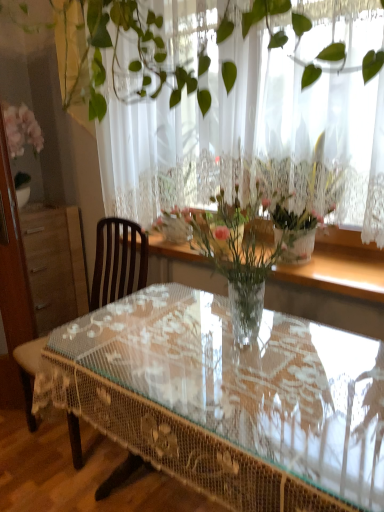
What are the coordinates of `brown wooden chair at left` in the screenshot? It's located at (118, 260).

What do you see at coordinates (239, 243) in the screenshot? I see `clear glass vase at center` at bounding box center [239, 243].

Measure the distance between clear wood window sill at upper center and camera.

clear wood window sill at upper center and camera are 1.62 meters apart.

Locate an element on the screen. This screenshot has width=384, height=512. brown wooden chair at left is located at coordinates (118, 260).

Is clear glass vase at center not near clear glass table at center?

No.

From the picture: Is clear glass vase at center oriented away from clear glass table at center?

No, clear glass vase at center is not facing away from clear glass table at center.

How different are the orientations of clear glass vase at center and clear glass table at center in degrees?

The angle between the facing direction of clear glass vase at center and the facing direction of clear glass table at center is 0.839 degrees.

Considering the sizes of objects clear glass vase at center and clear glass table at center in the image provided, who is shorter, clear glass vase at center or clear glass table at center?

clear glass vase at center.

From the image's perspective, relative to clear wood window sill at upper center, is white lace curtain at upper center above or below?

white lace curtain at upper center is situated higher than clear wood window sill at upper center in the image.

Is white lace curtain at upper center positioned with its back to clear wood window sill at upper center?

Absolutely, white lace curtain at upper center is directed away from clear wood window sill at upper center.

Is the depth of white lace curtain at upper center less than that of clear wood window sill at upper center?

Yes, it is in front of clear wood window sill at upper center.

Between clear glass table at center and clear glass vase at center, which one has smaller size?

Smaller between the two is clear glass vase at center.

From the image's perspective, is clear glass table at center located beneath clear glass vase at center?

Indeed, from the image's perspective, clear glass table at center is shown beneath clear glass vase at center.

Where is `coffee table on the left of clear glass vase at center`? The height and width of the screenshot is (512, 384). coffee table on the left of clear glass vase at center is located at coordinates (228, 399).

How distant is clear glass table at center from clear glass vase at center?

clear glass table at center and clear glass vase at center are 14.09 inches apart from each other.

Considering the sizes of white lace curtain at upper center and clear glass table at center in the image, is white lace curtain at upper center taller or shorter than clear glass table at center?

Considering their sizes, white lace curtain at upper center has more height than clear glass table at center.

Is white lace curtain at upper center oriented towards clear glass table at center?

No, white lace curtain at upper center is not oriented towards clear glass table at center.

Does white lace curtain at upper center appear on the left side of clear glass table at center?

Indeed, white lace curtain at upper center is positioned on the left side of clear glass table at center.

Between point (279, 172) and point (33, 406), which one is positioned behind?

The point (279, 172) is farther from the camera.

Is clear glass table at center far from white lace curtain at upper center?

No, clear glass table at center is not far from white lace curtain at upper center.

Locate an element on the screen. The height and width of the screenshot is (512, 384). coffee table below the white lace curtain at upper center (from the image's perspective) is located at coordinates (228, 399).

Which of these two, clear glass table at center or white lace curtain at upper center, is bigger?

clear glass table at center.

Between clear glass table at center and white lace curtain at upper center, which one has smaller width?

Thinner between the two is white lace curtain at upper center.

Based on the photo, are clear glass vase at center and white lace curtain at upper center far apart?

No, clear glass vase at center is in close proximity to white lace curtain at upper center.

In the scene shown: From a real-world perspective, which object stands above the other?

white lace curtain at upper center.

In terms of width, does clear glass vase at center look wider or thinner when compared to white lace curtain at upper center?

Considering their sizes, clear glass vase at center looks broader than white lace curtain at upper center.

Considering their positions, is clear wood window sill at upper center located in front of or behind clear glass vase at center?

In the image, clear wood window sill at upper center appears behind clear glass vase at center.

Is point (341, 276) behind point (229, 243)?

Yes.

From a real-world perspective, is clear wood window sill at upper center physically located above or below clear glass vase at center?

Clearly, from a real-world perspective, clear wood window sill at upper center is below clear glass vase at center.

Find the location of a particular element. The image size is (384, 512). coffee table on the left of clear glass vase at center is located at coordinates (228, 399).

Locate an element on the screen. This screenshot has width=384, height=512. window sill that is under the white lace curtain at upper center (from a real-world perspective) is located at coordinates (340, 266).

Considering their positions, is clear glass table at center positioned closer to white lace curtain at upper center than brown wooden chair at left?

brown wooden chair at left is closer to white lace curtain at upper center.

From the image, which object appears to be farther from clear glass table at center, clear wood window sill at upper center or white lace curtain at upper center?

white lace curtain at upper center.

Considering their positions, is white lace curtain at upper center positioned closer to brown wooden chair at left than clear wood window sill at upper center?

Based on the image, white lace curtain at upper center appears to be nearer to brown wooden chair at left.

Estimate the real-world distances between objects in this image. Which object is further from clear wood window sill at upper center, clear glass vase at center or white lace curtain at upper center?

Based on the image, white lace curtain at upper center appears to be further to clear wood window sill at upper center.

Which object lies further to the anchor point clear wood window sill at upper center, clear glass table at center or clear glass vase at center?

The object further to clear wood window sill at upper center is clear glass table at center.

Looking at the image, which one is located further to brown wooden chair at left, clear glass table at center or clear glass vase at center?

Based on the image, clear glass table at center appears to be further to brown wooden chair at left.

Based on their spatial positions, is clear glass vase at center or white lace curtain at upper center further from clear glass table at center?

white lace curtain at upper center lies further to clear glass table at center than the other object.

Considering their positions, is brown wooden chair at left positioned further to clear glass vase at center than clear glass table at center?

brown wooden chair at left.

This screenshot has width=384, height=512. In order to click on window sill between clear glass table at center and brown wooden chair at left along the z-axis in this screenshot , I will do `click(340, 266)`.

Locate an element on the screen. The height and width of the screenshot is (512, 384). window sill between white lace curtain at upper center and clear glass table at center vertically is located at coordinates (340, 266).

What are the coordinates of `chair that lies between white lace curtain at upper center and clear glass table at center from top to bottom` in the screenshot? It's located at (118, 260).

Locate an element on the screen. The width and height of the screenshot is (384, 512). floral arrangement between white lace curtain at upper center and clear glass table at center vertically is located at coordinates (239, 243).